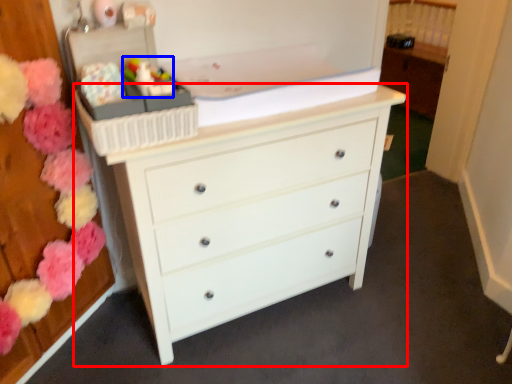
Question: Among these objects, which one is nearest to the camera, chest of drawers (highlighted by a red box) or toy (highlighted by a blue box)?

Choices:
 (A) chest of drawers
 (B) toy

Answer: (A)